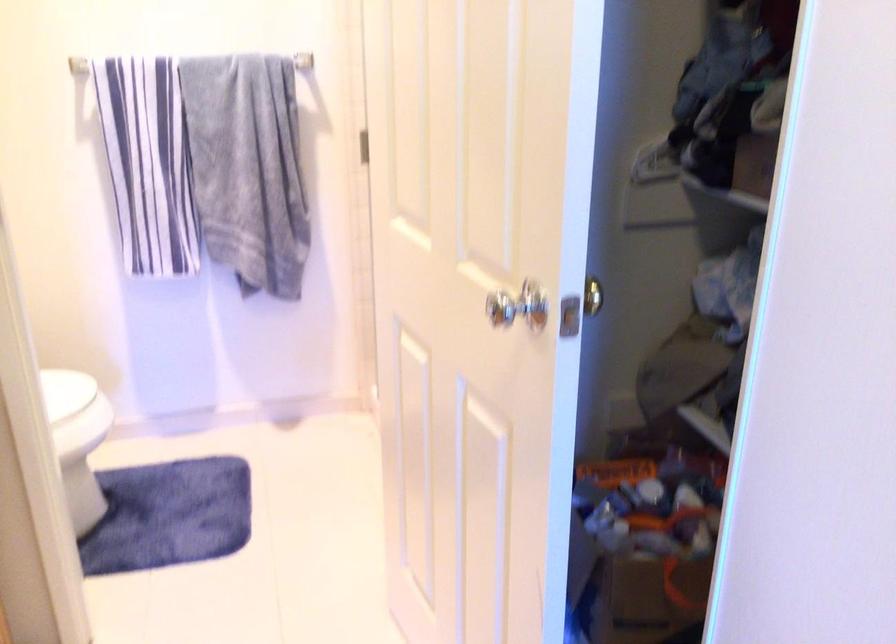
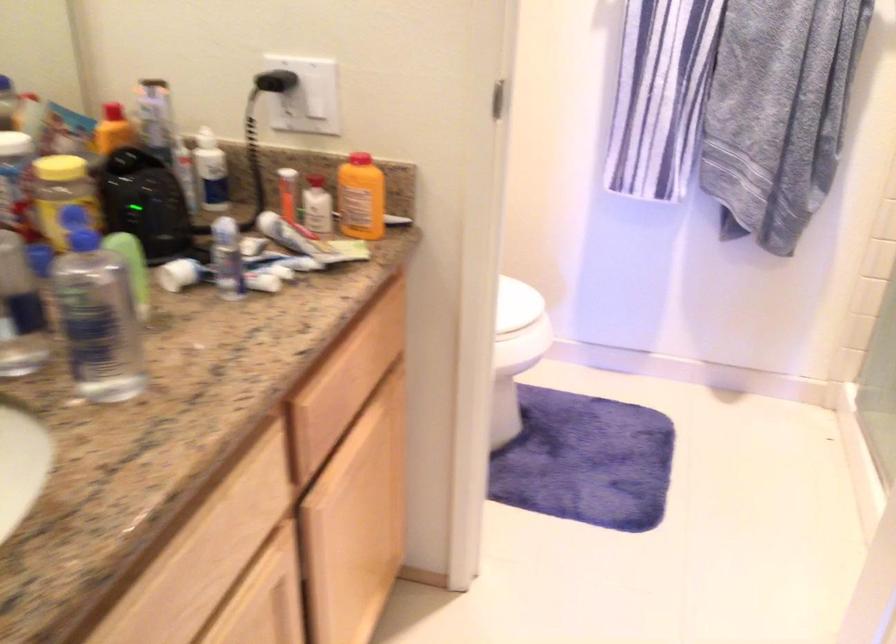
Question: The images are taken continuously from a first-person perspective. In which direction is your viewpoint rotating?

Choices:
 (A) Left
 (B) Right
 (C) Up
 (D) Down

Answer: (A)